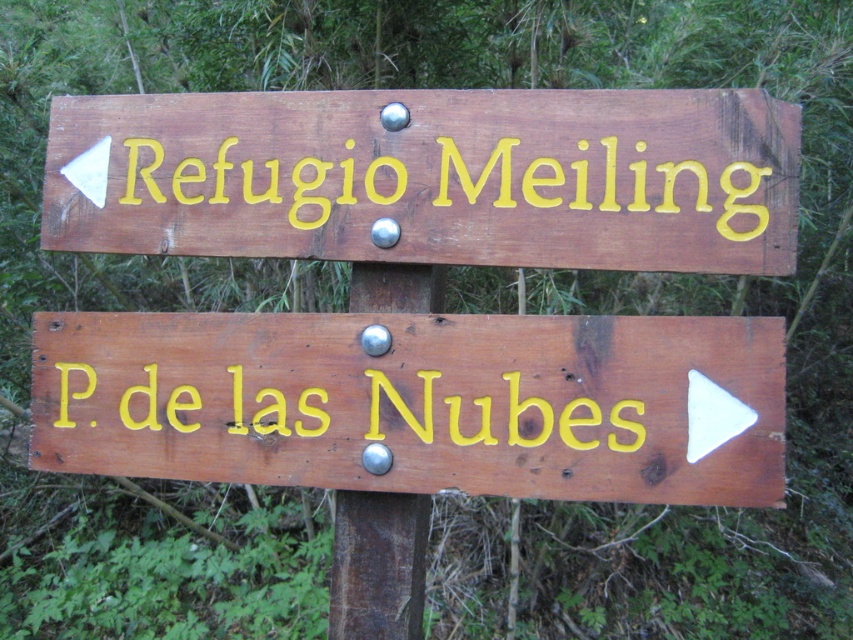
You are a hiker who needs to read both the wooden sign at lower right and the yellow painted wood at upper center. Which sign do you need to move closer to in order to read its text clearly?

The wooden sign at lower right has a larger width than the yellow painted wood at upper center, so you need to move closer to the wooden sign at lower right to read its text clearly because larger objects may require closer proximity for detailed reading.

You are standing in front of two wooden directional signs mounted on a post in a forest. The top sign points left to Refugio Meiling. The bottom sign is labeled as the wooden sign at lower right. If you want to reach the bottom sign without moving your feet, which direction should you move your head?

To reach the wooden sign at lower right without moving your feet, you should move your head downward since the bottom sign is positioned below the top sign on the post.